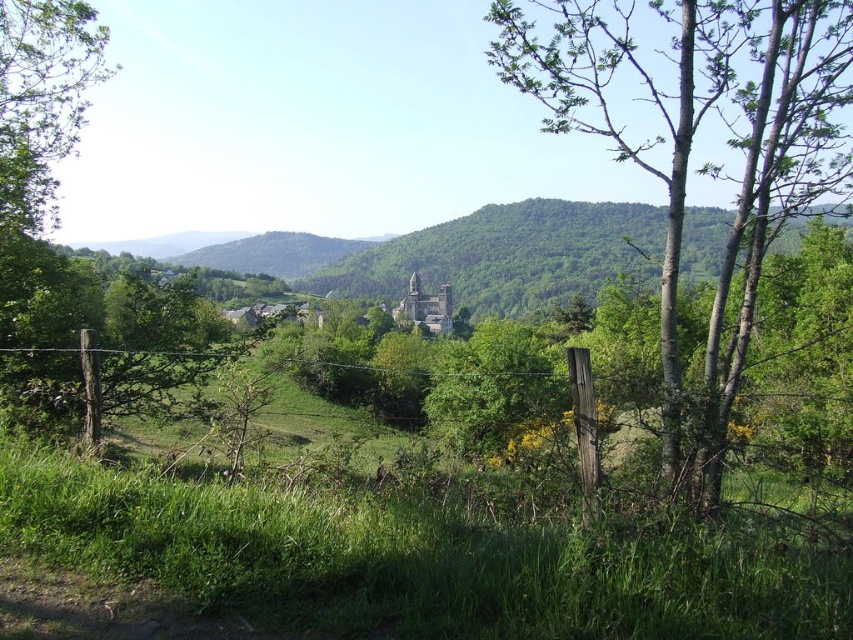
Question: Is green bark tree at center thinner than green forested mountain at center?

Choices:
 (A) no
 (B) yes

Answer: (B)

Question: Which object is closer to the camera taking this photo?

Choices:
 (A) green forested mountain at center
 (B) green bark tree at center

Answer: (B)

Question: Which object appears farthest from the camera in this image?

Choices:
 (A) green bark tree at center
 (B) green forested mountain at center

Answer: (B)

Question: Observing the image, what is the correct spatial positioning of green bark tree at center in reference to green forested mountain at center?

Choices:
 (A) right
 (B) left

Answer: (A)

Question: Is green bark tree at center to the left of green forested mountain at center from the viewer's perspective?

Choices:
 (A) no
 (B) yes

Answer: (A)

Question: Which of the following is the farthest from the observer?

Choices:
 (A) green forested mountain at center
 (B) green bark tree at center

Answer: (A)